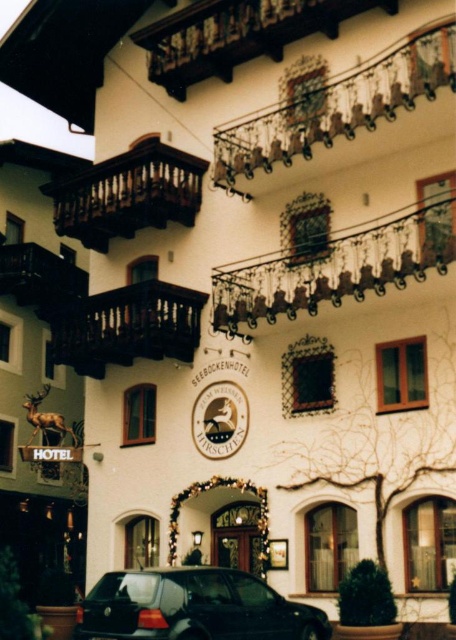
Is dark brown wood balcony at center left smaller than gold metallic clock at center?

Actually, dark brown wood balcony at center left might be larger than gold metallic clock at center.

Which is behind, point (72, 330) or point (242, 397)?

Point (72, 330)

Image resolution: width=456 pixels, height=640 pixels. In order to click on dark brown wood balcony at center left in this screenshot , I will do `click(128, 326)`.

Does brown wooden balcony at upper center have a lesser width compared to dark brown wood balcony at center left?

Incorrect, brown wooden balcony at upper center's width is not less than dark brown wood balcony at center left's.

Who is more forward, [62,177] or [159,305]?

Positioned in front is point [159,305].

Looking at this image, who is more distant from viewer, (100, 173) or (129, 291)?

Positioned behind is point (100, 173).

Image resolution: width=456 pixels, height=640 pixels. I want to click on brown wooden balcony at upper center, so click(128, 193).

Describe the element at coordinates (336, 266) in the screenshot. I see `polished wrought iron balcony at center` at that location.

Can you confirm if polished wrought iron balcony at center is bigger than gold metallic clock at center?

Indeed, polished wrought iron balcony at center has a larger size compared to gold metallic clock at center.

Which is in front, point (309, 262) or point (229, 381)?

Point (309, 262) is more forward.

Locate an element on the screen. Image resolution: width=456 pixels, height=640 pixels. polished wrought iron balcony at center is located at coordinates (336, 266).